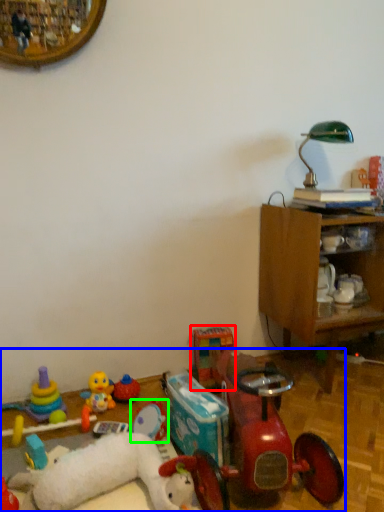
Question: Based on their relative distances, which object is nearer to toy (highlighted by a red box)? Choose from toy (highlighted by a blue box) and toy (highlighted by a green box).

Choices:
 (A) toy
 (B) toy

Answer: (B)